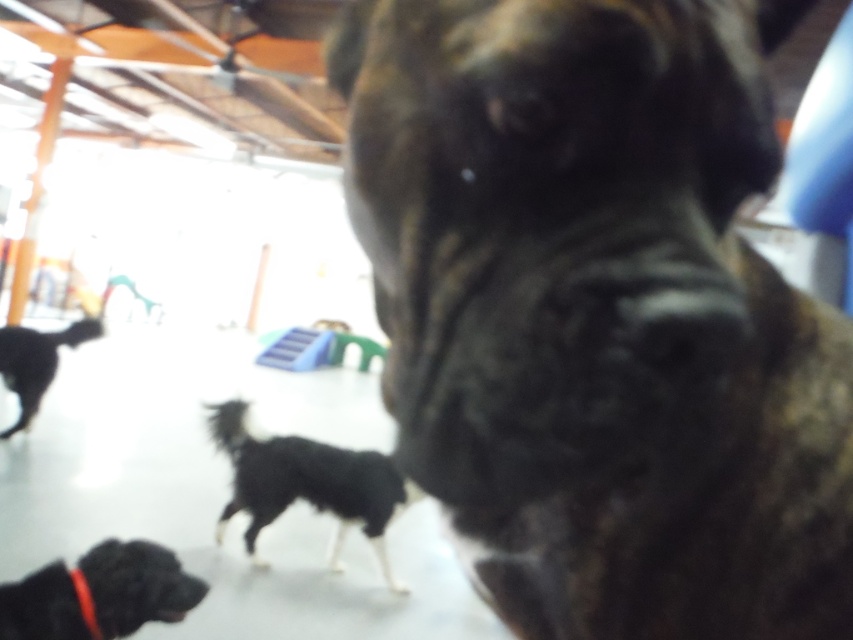
Question: Which object is positioned farthest from the red fabric neckband at lower left?

Choices:
 (A) black fur dog at center
 (B) brown brindle dog at center

Answer: (A)

Question: Can you confirm if black fur dog at center is thinner than red fabric neckband at lower left?

Choices:
 (A) no
 (B) yes

Answer: (A)

Question: Is black fur dog at left to the right of red fabric neckband at lower left from the viewer's perspective?

Choices:
 (A) yes
 (B) no

Answer: (B)

Question: Which point appears closest to the camera in this image?

Choices:
 (A) (13, 371)
 (B) (77, 598)

Answer: (B)

Question: Among these objects, which one is farthest from the camera?

Choices:
 (A) black matte dog at lower left
 (B) black fur dog at center

Answer: (B)

Question: Is brown brindle dog at center thinner than black fur dog at left?

Choices:
 (A) no
 (B) yes

Answer: (B)